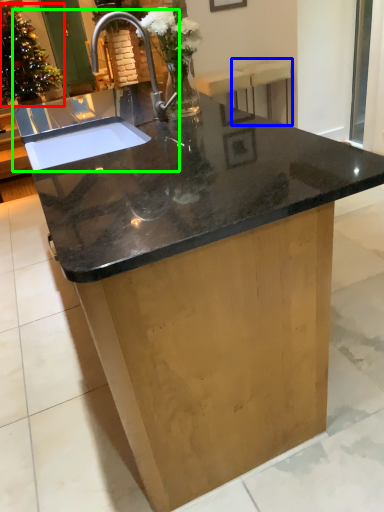
Question: Which object is positioned farthest from floral arrangement (highlighted by a red box)? Select from bar stool (highlighted by a blue box) and sink (highlighted by a green box).

Choices:
 (A) bar stool
 (B) sink

Answer: (B)